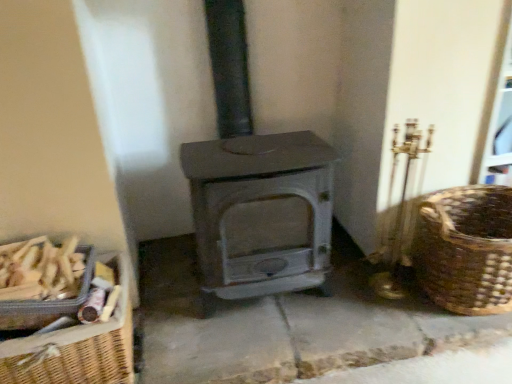
Question: Is matte gray wood burning stove at center bigger than woven wood basket at left, the second basket viewed from the left?

Choices:
 (A) no
 (B) yes

Answer: (B)

Question: From the image's perspective, would you say matte gray wood burning stove at center is positioned over woven wood basket at left, arranged as the 2th basket when viewed from the right?

Choices:
 (A) no
 (B) yes

Answer: (B)

Question: Does matte gray wood burning stove at center lie behind woven wood basket at left, the second basket viewed from the left?

Choices:
 (A) yes
 (B) no

Answer: (B)

Question: Does matte gray wood burning stove at center lie in front of woven wood basket at left, arranged as the 2th basket when viewed from the right?

Choices:
 (A) no
 (B) yes

Answer: (B)

Question: Is matte gray wood burning stove at center touching woven wood basket at left, the second basket viewed from the left?

Choices:
 (A) yes
 (B) no

Answer: (B)

Question: In terms of size, does brown woven basket at right, placed as the 1th basket when sorted from right to left, appear bigger or smaller than woven wood basket at left, arranged as the 2th basket when viewed from the right?

Choices:
 (A) big
 (B) small

Answer: (A)

Question: Is brown woven basket at right, placed as the 1th basket when sorted from right to left, spatially inside woven wood basket at left, arranged as the 2th basket when viewed from the right, or outside of it?

Choices:
 (A) outside
 (B) inside

Answer: (A)

Question: Based on their positions, is brown woven basket at right, placed as the 1th basket when sorted from right to left, located to the left or right of woven wood basket at left, arranged as the 2th basket when viewed from the right?

Choices:
 (A) right
 (B) left

Answer: (A)

Question: From their relative heights in the image, would you say brown woven basket at right, placed as the 1th basket when sorted from right to left, is taller or shorter than woven wood basket at left, the second basket viewed from the left?

Choices:
 (A) short
 (B) tall

Answer: (B)

Question: Looking at their shapes, would you say woven brown basket at lower left, which is the 3th basket in right-to-left order, is wider or thinner than brown woven basket at right, placed as the 1th basket when sorted from right to left?

Choices:
 (A) thin
 (B) wide

Answer: (A)

Question: From a real-world perspective, is woven brown basket at lower left, placed as the 1th basket when sorted from left to right, physically located above or below brown woven basket at right, which is the 3th basket in left-to-right order?

Choices:
 (A) below
 (B) above

Answer: (B)

Question: Is woven brown basket at lower left, which is the 3th basket in right-to-left order, situated inside brown woven basket at right, which is the 3th basket in left-to-right order, or outside?

Choices:
 (A) inside
 (B) outside

Answer: (B)

Question: Considering the positions of woven brown basket at lower left, placed as the 1th basket when sorted from left to right, and brown woven basket at right, placed as the 1th basket when sorted from right to left, in the image, is woven brown basket at lower left, placed as the 1th basket when sorted from left to right, taller or shorter than brown woven basket at right, placed as the 1th basket when sorted from right to left,?

Choices:
 (A) tall
 (B) short

Answer: (B)

Question: Considering the positions of point 70,309 and point 245,109, is point 70,309 closer or farther from the camera than point 245,109?

Choices:
 (A) closer
 (B) farther

Answer: (A)

Question: From a real-world perspective, relative to matte gray wood burning stove at center, is woven brown basket at lower left, placed as the 1th basket when sorted from left to right, vertically above or below?

Choices:
 (A) above
 (B) below

Answer: (B)